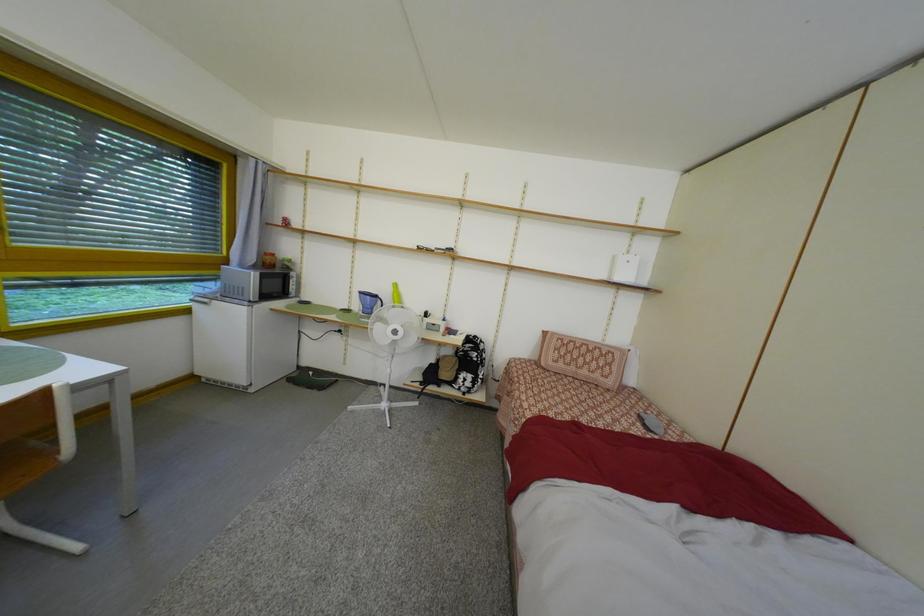
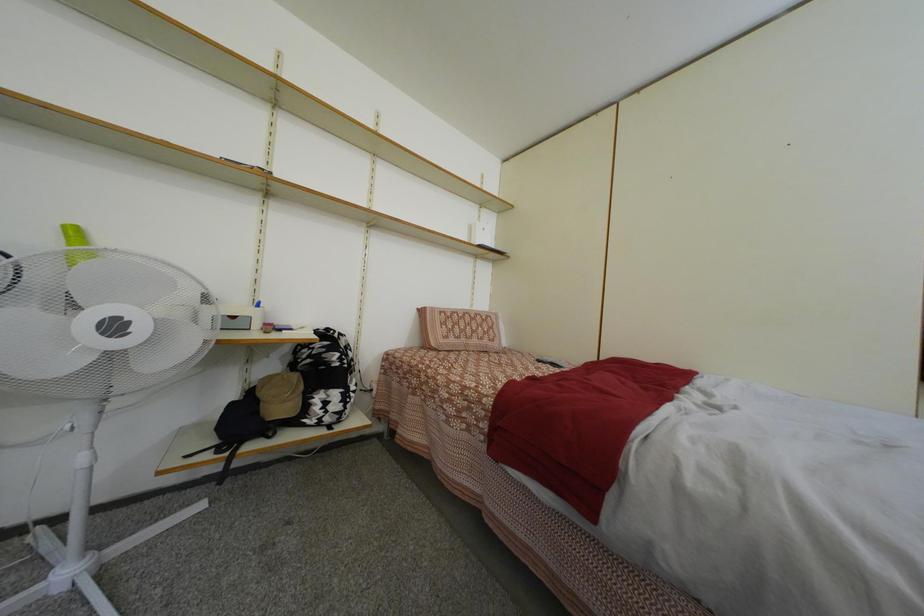
Question: How did the camera likely rotate?

Choices:
 (A) Left
 (B) Right
 (C) Up
 (D) Down

Answer: (B)